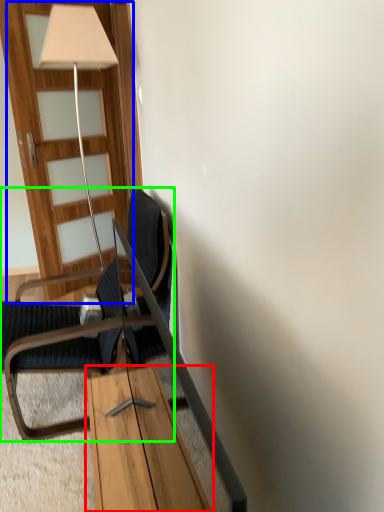
Question: Based on their relative distances, which object is farther from table (highlighted by a red box)? Choose from door (highlighted by a blue box) and chair (highlighted by a green box).

Choices:
 (A) door
 (B) chair

Answer: (A)